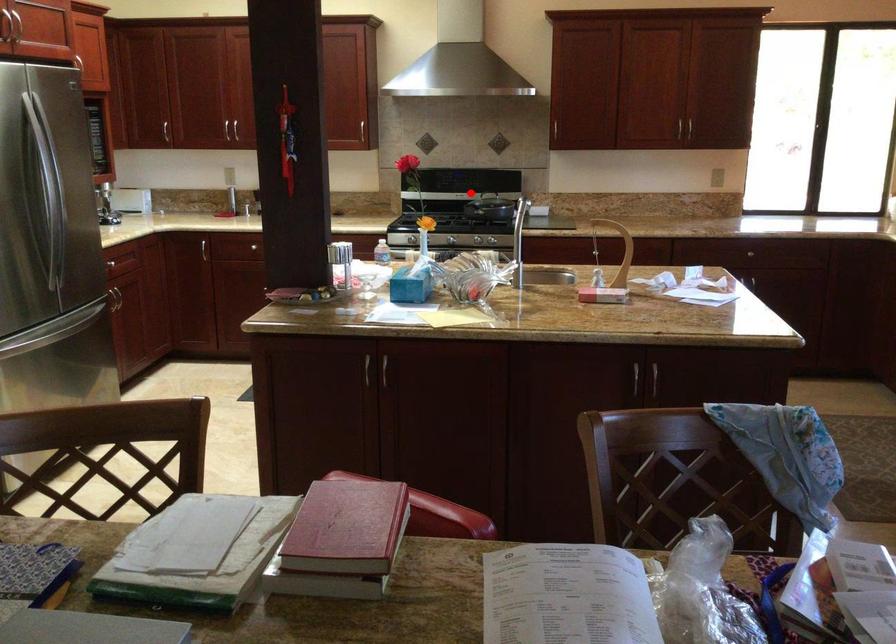
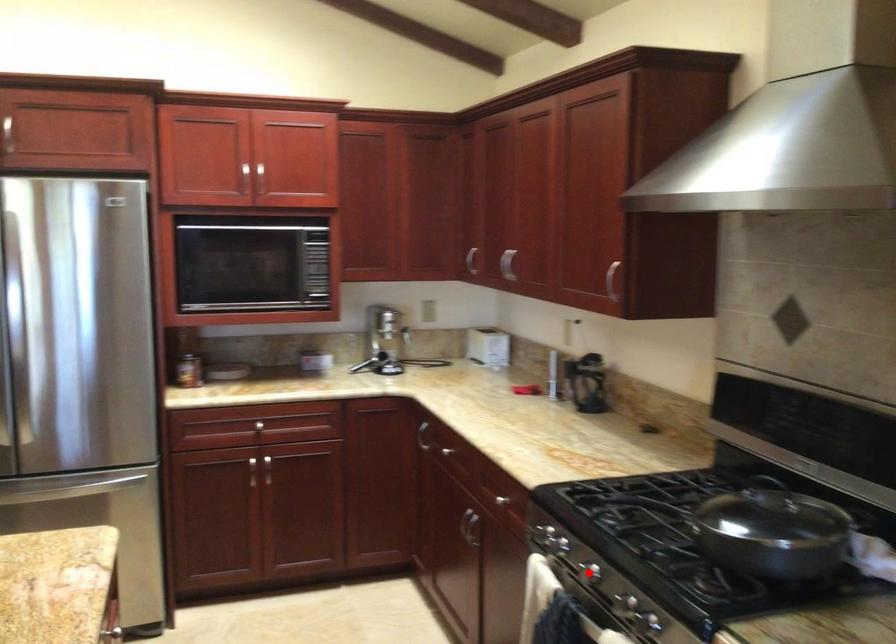
I am providing you with two images of the same scene from different viewpoints. A red point is marked on the first image and another point is marked on the second image. Is the red point in image1 aligned with the point shown in image2?

No